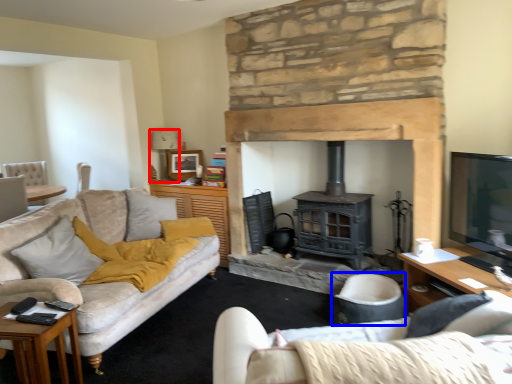
Question: Which point is further to the camera, lamp (highlighted by a red box) or armchair (highlighted by a blue box)?

Choices:
 (A) lamp
 (B) armchair

Answer: (A)